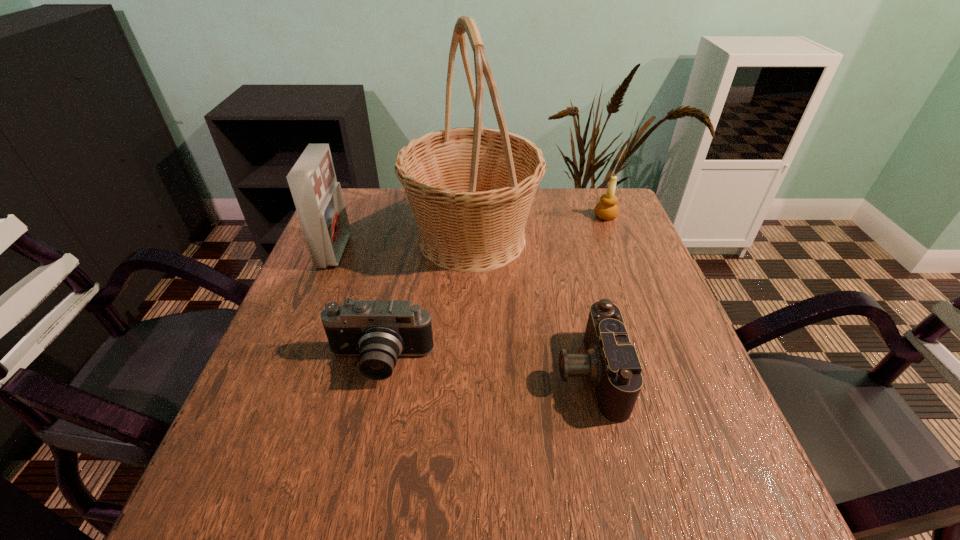
I want to click on object present at the far right corner, so click(607, 209).

In the image, there is a desktop. At what (x,y) coordinates should I click in order to perform the action: click on free space at the far edge. Please return your answer as a coordinate pair (x, y). The image size is (960, 540). Looking at the image, I should click on (555, 213).

Locate an element on the screen. This screenshot has height=540, width=960. free space at the near edge of the desktop is located at coordinates (558, 530).

Locate an element on the screen. The width and height of the screenshot is (960, 540). free region at the left edge of the desktop is located at coordinates (366, 242).

Identify the location of vacant space at the right edge. The image size is (960, 540). (592, 234).

At what (x,y) coordinates should I click in order to perform the action: click on vacant region at the far left corner. Please return your answer as a coordinate pair (x, y). Looking at the image, I should click on (375, 221).

This screenshot has width=960, height=540. Identify the location of free space at the far right corner of the desktop. (583, 222).

Locate an element on the screen. vacant space at the near right corner is located at coordinates (691, 504).

I want to click on vacant space that is in between the left camera and the tallest object, so click(x=426, y=301).

What are the coordinates of `free space between the basket and the shortest object` in the screenshot? It's located at (530, 306).